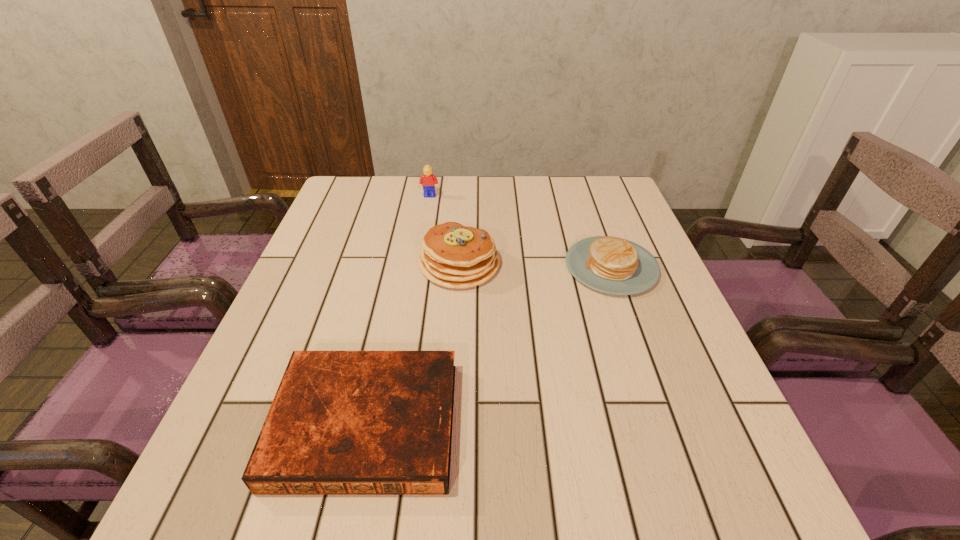
What are the coordinates of `the farthest object` in the screenshot? It's located at (428, 180).

Where is `the taller pancake`? Image resolution: width=960 pixels, height=540 pixels. the taller pancake is located at coordinates [455, 256].

Where is `the shorter pancake`? The width and height of the screenshot is (960, 540). the shorter pancake is located at coordinates (612, 265).

Identify the location of the rightmost object. This screenshot has height=540, width=960. (612, 265).

Identify the location of the nearest object. (342, 422).

Identify the location of free location located 0.140m on the front-facing side of the Lego. (425, 225).

In order to click on free space located 0.250m on the back of the left pancake in this screenshot , I will do point(464,192).

Image resolution: width=960 pixels, height=540 pixels. What are the coordinates of `blank space located 0.300m on the front of the shorter pancake` in the screenshot? It's located at (665, 420).

This screenshot has width=960, height=540. I want to click on object that is at the far edge, so click(x=428, y=180).

In order to click on object positioned at the near edge in this screenshot , I will do `click(342, 422)`.